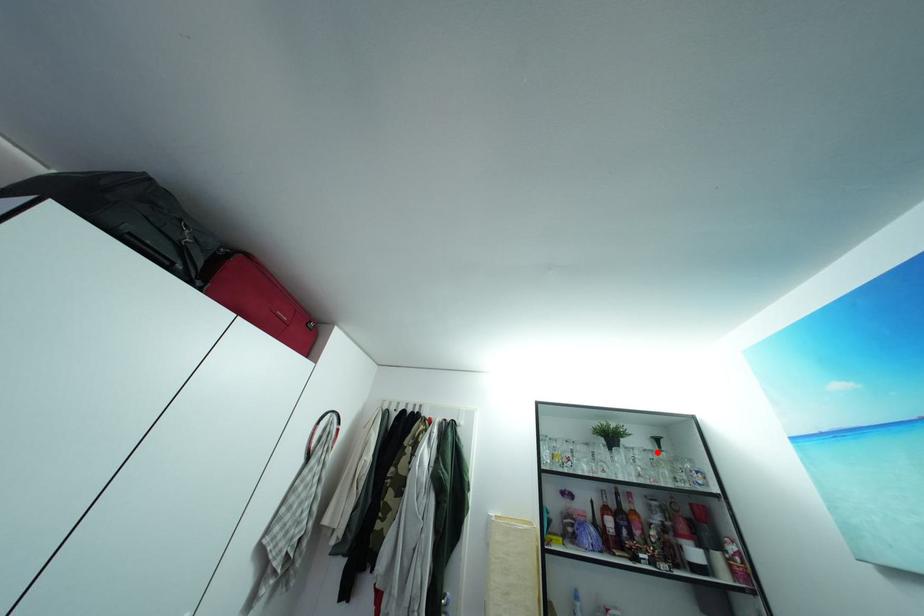
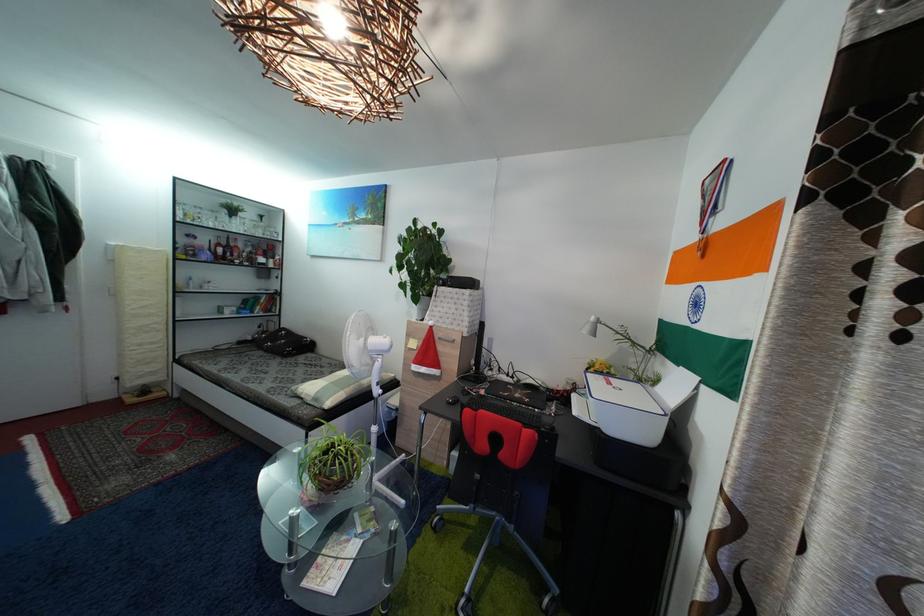
Find the pixel in the second image that matches the highlighted location in the first image.

(264, 225)